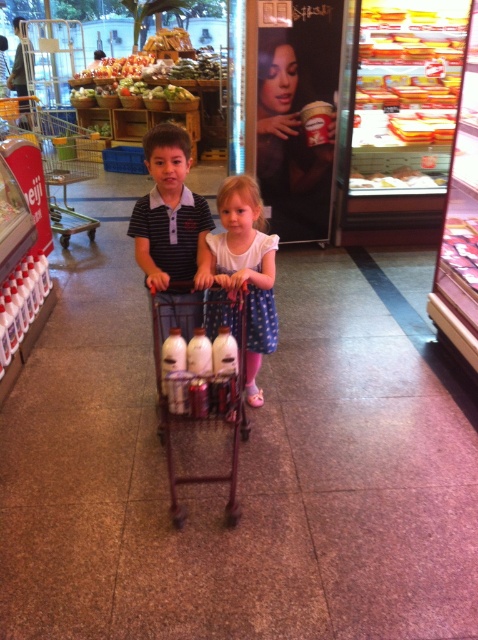
Consider the image. Between white polka dot dress at center and metallic silver trolley at center, which one has less height?

Standing shorter between the two is white polka dot dress at center.

Between point (226, 188) and point (25, 115), which one is positioned behind?

The point (25, 115) is behind.

Where is `white polka dot dress at center`? This screenshot has width=478, height=640. white polka dot dress at center is located at coordinates (247, 269).

Is metallic brown trolley at center thinner than metallic silver trolley at center?

Yes, metallic brown trolley at center is thinner than metallic silver trolley at center.

Is point (230, 484) less distant than point (6, 113)?

Yes.

Between point (170, 442) and point (96, 163), which one is positioned in front?

Point (170, 442)

Identify the location of metallic brown trolley at center. This screenshot has height=640, width=478. (199, 401).

Who is higher up, white polka dot dress at center or metallic brown trolley at center?

white polka dot dress at center is higher up.

The height and width of the screenshot is (640, 478). What are the coordinates of `white polka dot dress at center` in the screenshot? It's located at (247, 269).

Where is `white polka dot dress at center`? This screenshot has width=478, height=640. white polka dot dress at center is located at coordinates [247, 269].